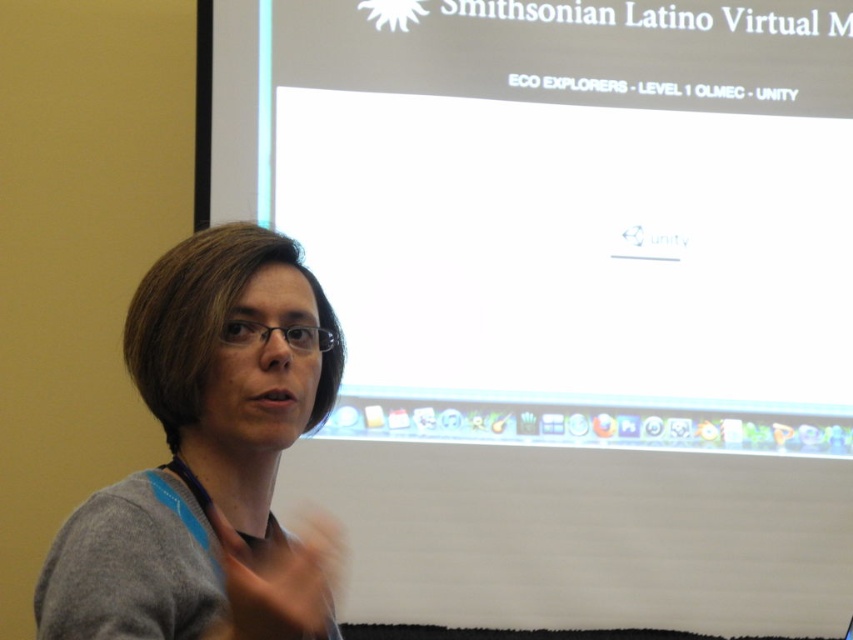
You are attending a presentation and notice the white glossy projector screen at upper center and the gray matte sweater at left. Which object is located above the other?

The white glossy projector screen at upper center is positioned over gray matte sweater at left, so it is above the sweater.

You are an interior designer assessing the space for a new presentation setup. You notice the white glossy projector screen at upper center and the gray matte sweater at left. Which object has a greater width?

The white glossy projector screen at upper center has a greater width than the gray matte sweater at left according to the description.

You are attending a presentation and need to adjust the focus of the projector. The projector is located 10 feet behind you. The white glossy projector screen at upper center is the only screen available. Can you reach the projector to adjust it if you are standing at the front of the room?

The white glossy projector screen at upper center is 9.18 feet away from the viewer. Since the projector is 10 feet behind you, you would need to walk back approximately 0.82 feet to reach it, which is feasible.